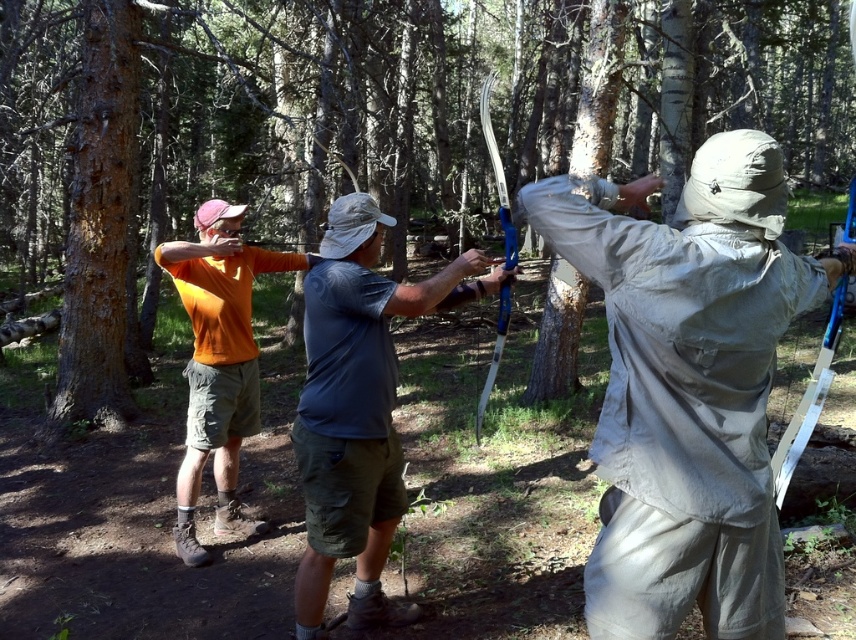
Does brown rough tree at center appear on the right side of gray fabric shirt at center?

Indeed, brown rough tree at center is positioned on the right side of gray fabric shirt at center.

Measure the distance between brown rough tree at center and camera.

A distance of 4.56 meters exists between brown rough tree at center and camera.

Where is `brown rough tree at center`? Image resolution: width=856 pixels, height=640 pixels. brown rough tree at center is located at coordinates (459, 108).

Between point (232, 65) and point (238, 282), which one is positioned behind?

Point (232, 65)

Which is in front, point (508, 60) or point (187, 432)?

Positioned in front is point (187, 432).

Identify the location of brown rough tree at center. (459, 108).

Which is above, khaki fabric jacket at center or gray fabric shirt at center?

Positioned higher is khaki fabric jacket at center.

Image resolution: width=856 pixels, height=640 pixels. Describe the element at coordinates (687, 385) in the screenshot. I see `khaki fabric jacket at center` at that location.

Locate an element on the screen. khaki fabric jacket at center is located at coordinates (687, 385).